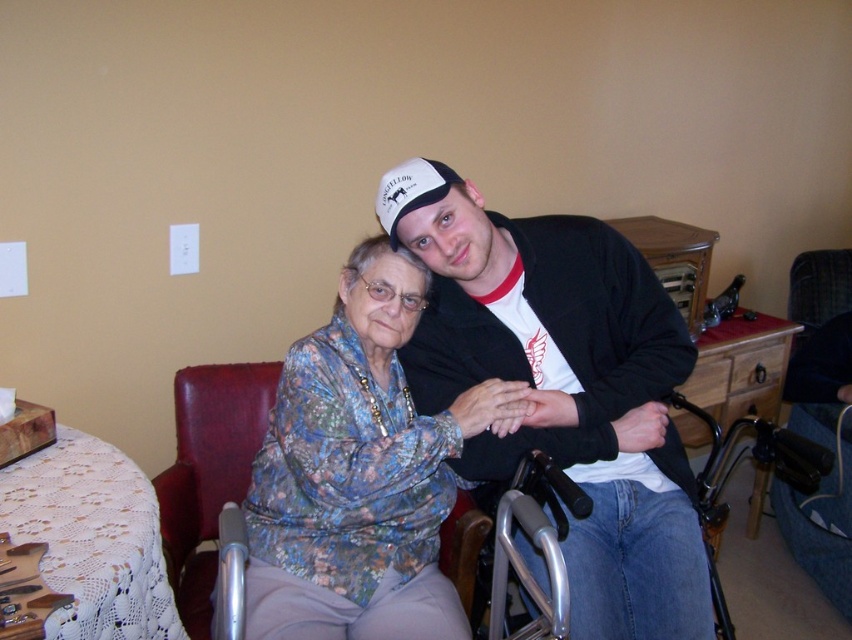
Question: Which of the following is the farthest from the observer?

Choices:
 (A) matte black jacket at center
 (B) silver metallic wheelchair at lower right

Answer: (B)

Question: Among these objects, which one is farthest from the camera?

Choices:
 (A) matte black jacket at center
 (B) floral fabric blouse at center
 (C) leather at left
 (D) white matte baseball cap at upper center

Answer: (C)

Question: Does floral fabric blouse at center appear on the left side of white matte baseball cap at upper center?

Choices:
 (A) yes
 (B) no

Answer: (A)

Question: Which is nearer to the white matte baseball cap at upper center?

Choices:
 (A) floral fabric blouse at center
 (B) matte black jacket at center
 (C) silver metallic wheelchair at lower right
 (D) leather at left

Answer: (B)

Question: Is matte black jacket at center closer to the viewer compared to white matte baseball cap at upper center?

Choices:
 (A) no
 (B) yes

Answer: (B)

Question: Considering the relative positions of matte black jacket at center and leather at left in the image provided, where is matte black jacket at center located with respect to leather at left?

Choices:
 (A) right
 (B) left

Answer: (A)